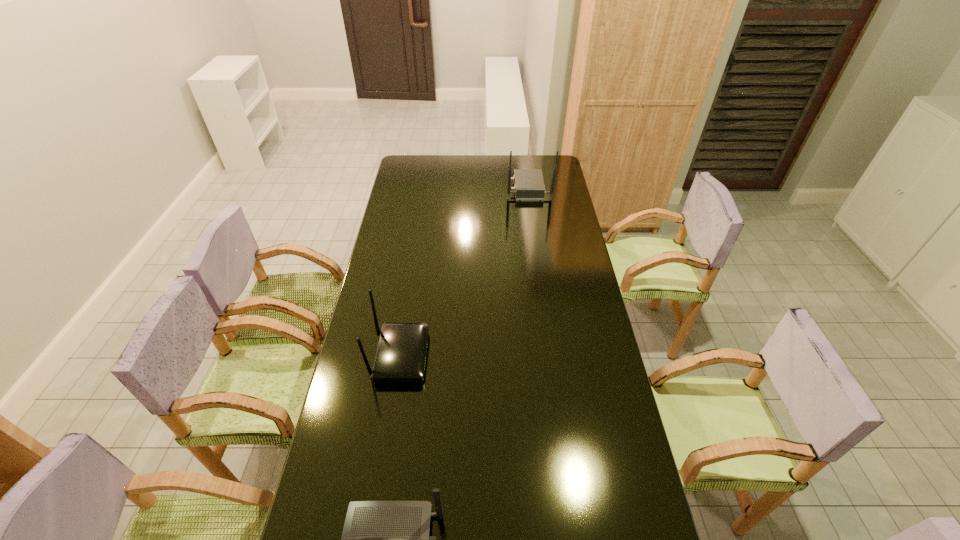
This screenshot has width=960, height=540. Find the location of `object situated at the right edge`. object situated at the right edge is located at coordinates (529, 186).

The width and height of the screenshot is (960, 540). I want to click on object located at the far right corner, so click(x=529, y=186).

Locate an element on the screen. free space at the far edge is located at coordinates (437, 157).

The image size is (960, 540). In the image, there is a desktop. What are the coordinates of `free space at the left edge` in the screenshot? It's located at (411, 188).

Where is `vacant area at the right edge of the desktop`? vacant area at the right edge of the desktop is located at coordinates (550, 251).

The height and width of the screenshot is (540, 960). In the image, there is a desktop. Identify the location of vacant space at the far left corner. (419, 164).

Where is `vacant area that lies between the farthest router and the second shortest router`? The image size is (960, 540). vacant area that lies between the farthest router and the second shortest router is located at coordinates (x=465, y=272).

This screenshot has width=960, height=540. I want to click on vacant space that is in between the farthest object and the second nearest object, so click(x=465, y=272).

You are a GUI agent. You are given a task and a screenshot of the screen. Output one action in this format:
    pyautogui.click(x=<x>, y=<y>)
    Task: Click on the object that stands as the closest to the second nearest router
    The height and width of the screenshot is (540, 960).
    Given the screenshot: What is the action you would take?
    pyautogui.click(x=381, y=539)

Locate an element on the screen. This screenshot has height=540, width=960. object that is the second nearest to the tallest router is located at coordinates (381, 539).